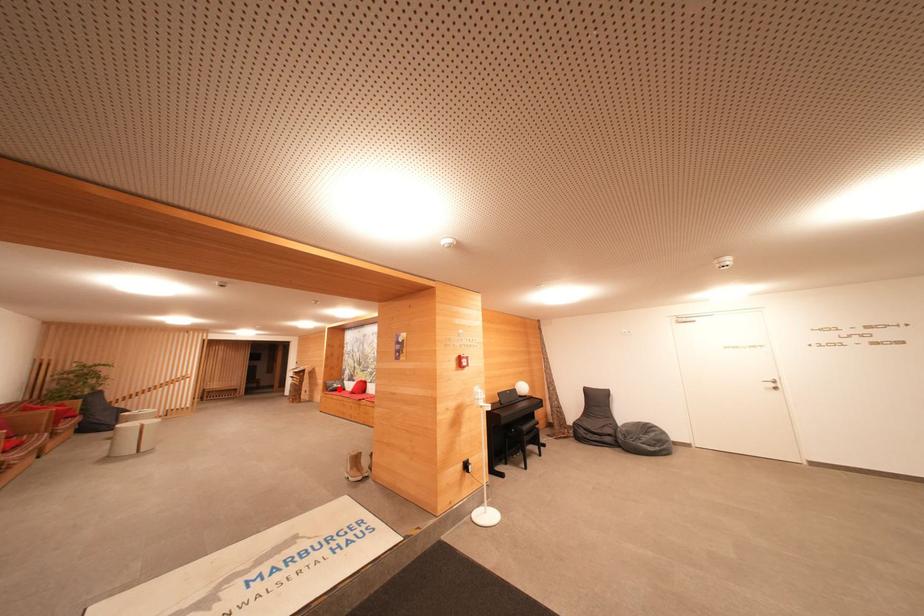
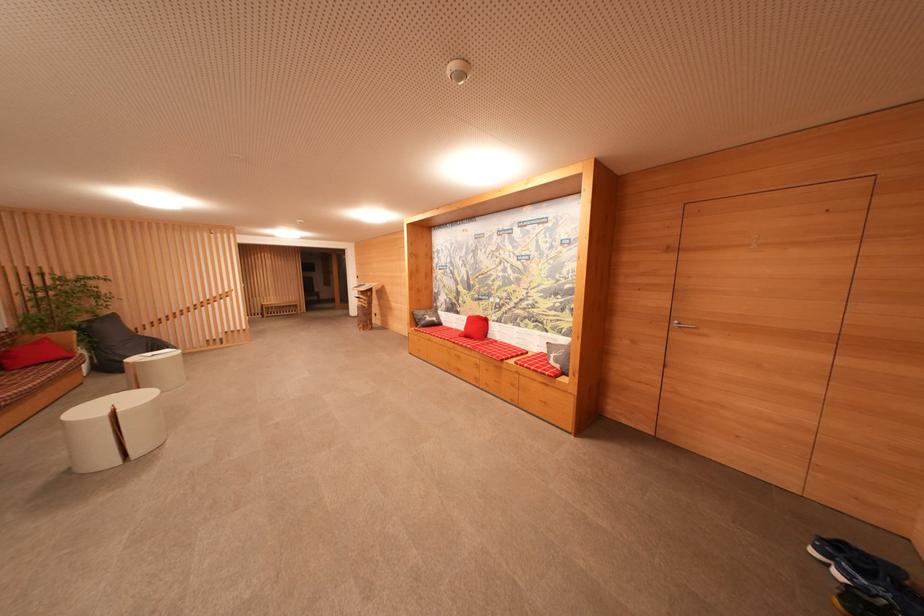
Question: I am providing you with two images of the same scene from different viewpoints. Given a red point in image1, look at the same physical point in image2. Is it:

Choices:
 (A) Closer to the viewpoint
 (B) Farther from the viewpoint

Answer: (A)